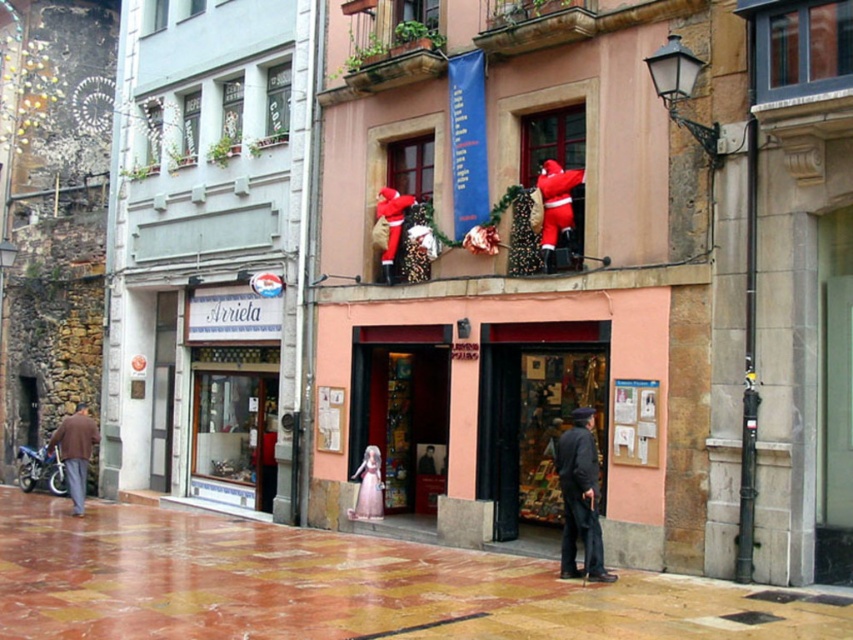
Does marble at center appear over brown woolen jacket at lower left?

No, marble at center is not above brown woolen jacket at lower left.

Between marble at center and brown woolen jacket at lower left, which one has less height?

With less height is marble at center.

The height and width of the screenshot is (640, 853). What do you see at coordinates (338, 586) in the screenshot? I see `marble at center` at bounding box center [338, 586].

Find the location of a particular element. The width and height of the screenshot is (853, 640). marble at center is located at coordinates (338, 586).

Is velvet red santa at upper right to the right of brown woolen jacket at lower left from the viewer's perspective?

Correct, you'll find velvet red santa at upper right to the right of brown woolen jacket at lower left.

In the scene shown: Who is higher up, velvet red santa at upper right or brown woolen jacket at lower left?

velvet red santa at upper right is above.

Locate an element on the screen. The width and height of the screenshot is (853, 640). velvet red santa at upper right is located at coordinates (556, 208).

Between point (154, 612) and point (567, 250), which one is positioned in front?

Positioned in front is point (154, 612).

Does point (412, 547) come closer to viewer compared to point (569, 177)?

No, it is behind (569, 177).

Image resolution: width=853 pixels, height=640 pixels. Describe the element at coordinates (338, 586) in the screenshot. I see `marble at center` at that location.

Find the location of a particular element. The height and width of the screenshot is (640, 853). marble at center is located at coordinates (338, 586).